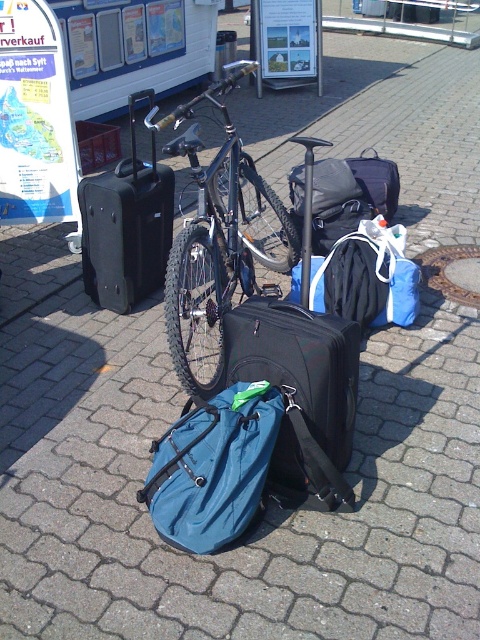
Between black matte suitcase at center and black hardshell suitcase at center, which one is positioned higher?

Positioned higher is black hardshell suitcase at center.

Which is behind, point (322, 401) or point (171, 189)?

The point (171, 189) is behind.

Is point (324, 465) less distant than point (121, 260)?

That is True.

This screenshot has height=640, width=480. What are the coordinates of `black matte suitcase at center` in the screenshot? It's located at (300, 394).

Who is lower down, shiny black bicycle at center or black hardshell suitcase at center?

Positioned lower is black hardshell suitcase at center.

Is shiny black bicycle at center to the right of black hardshell suitcase at center from the viewer's perspective?

Correct, you'll find shiny black bicycle at center to the right of black hardshell suitcase at center.

Where is `shiny black bicycle at center`? Image resolution: width=480 pixels, height=640 pixels. shiny black bicycle at center is located at coordinates (214, 243).

Find the location of a particular element. shiny black bicycle at center is located at coordinates (214, 243).

Does black matte suitcase at center appear on the left side of shiny black bicycle at center?

In fact, black matte suitcase at center is to the right of shiny black bicycle at center.

Between black matte suitcase at center and shiny black bicycle at center, which one appears on the left side from the viewer's perspective?

shiny black bicycle at center is more to the left.

Does point (279, 465) come farther from viewer compared to point (288, 232)?

No, it is not.

You are a GUI agent. You are given a task and a screenshot of the screen. Output one action in this format:
    pyautogui.click(x=<x>, y=<y>)
    Task: Click on the black matte suitcase at center
    The image size is (480, 640).
    Given the screenshot: What is the action you would take?
    pyautogui.click(x=300, y=394)